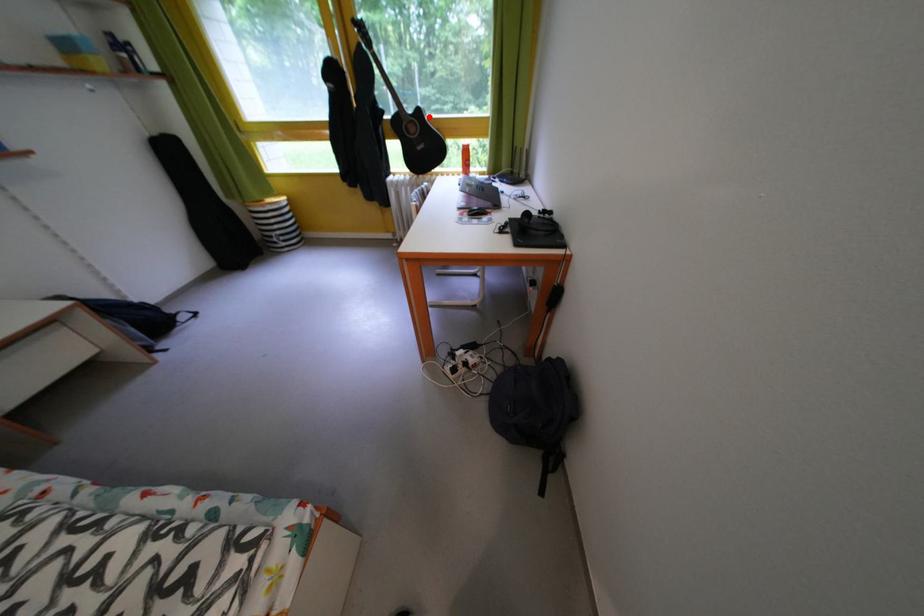
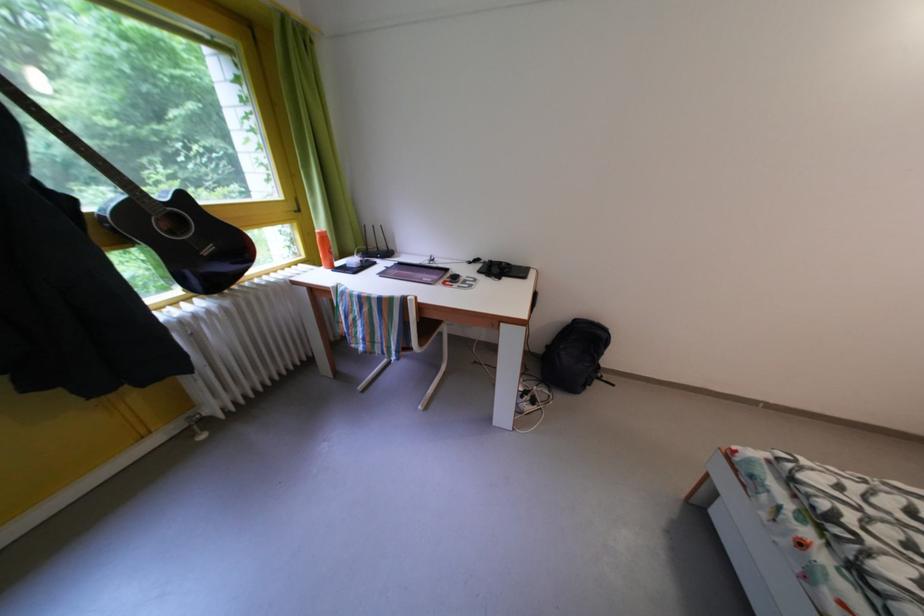
Question: A red point is marked in image1. In image2, is the corresponding 3D point closer to the camera or farther? Reply with the corresponding letter.

Choices:
 (A) The corresponding 3D point is closer.
 (B) The corresponding 3D point is farther.

Answer: (B)